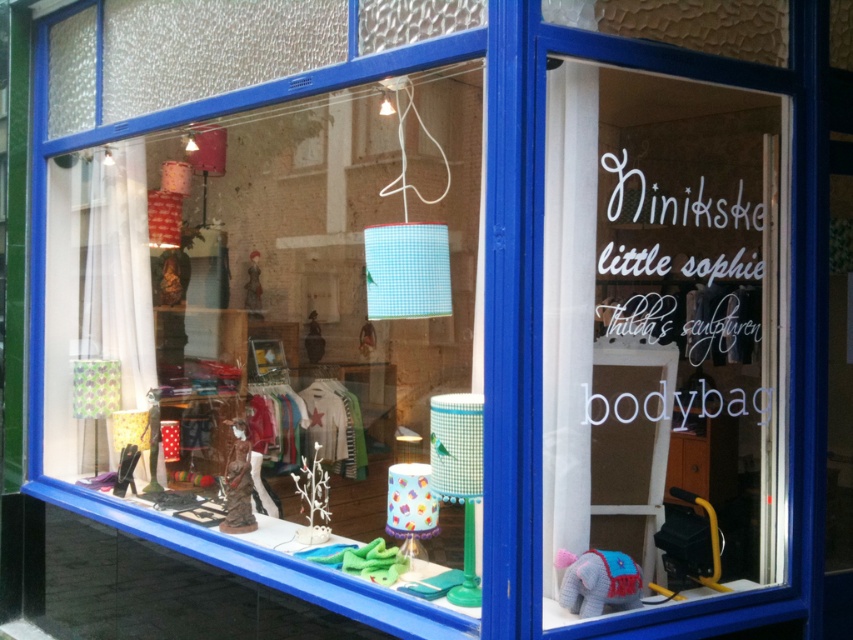
You are a customer looking at the store window display. You see the knitted plush elephant at lower right and the matte brown figurine at center. Which object is closer to the bottom of the window?

The knitted plush elephant at lower right is closer to the bottom of the window because it is positioned under the matte brown figurine at center.

You are a customer standing in front of the storefront window. You notice the matte fabric lampshade at center. Can you determine its exact position using coordinates?

The matte fabric lampshade at center is located at coordinates point [276,316].